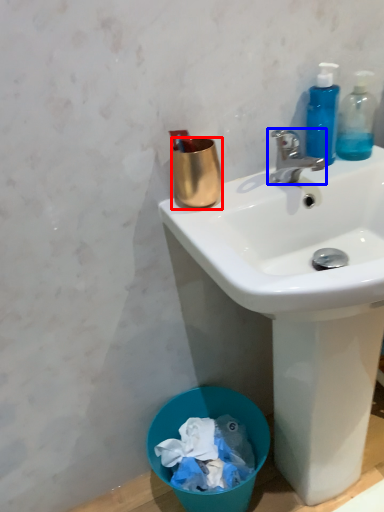
Question: Among these objects, which one is nearest to the camera, coffee cup (highlighted by a red box) or faucet (highlighted by a blue box)?

Choices:
 (A) coffee cup
 (B) faucet

Answer: (B)